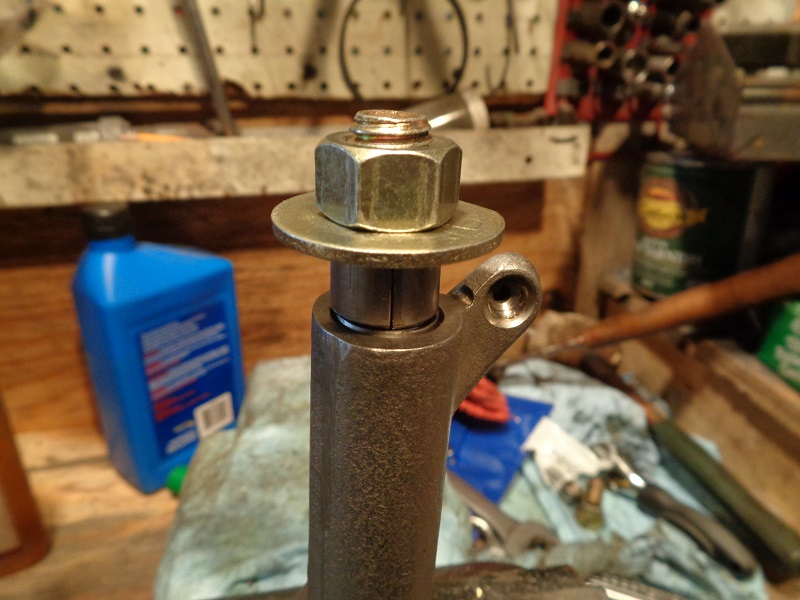
At what (x,y) coordinates should I click in order to perform the action: click on dirty cloth. Please return your answer as a coordinate pair (x, y). The width and height of the screenshot is (800, 600). Looking at the image, I should click on (249, 474).